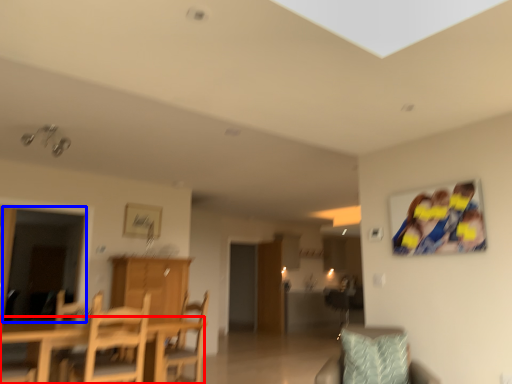
Question: Which object appears closest to the camera in this image, table (highlighted by a red box) or glass door (highlighted by a blue box)?

Choices:
 (A) table
 (B) glass door

Answer: (A)